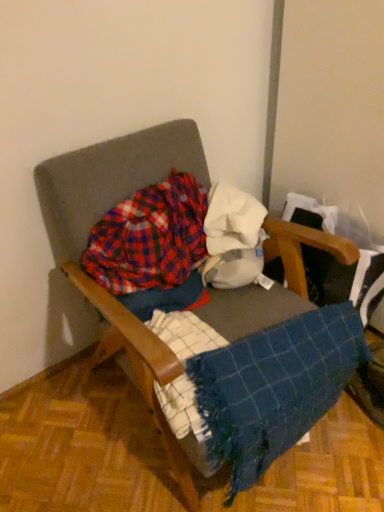
Question: From the image's perspective, relative to blue woven blanket at lower right, is wooden armchair at center above or below?

Choices:
 (A) below
 (B) above

Answer: (B)

Question: Does point (172, 375) appear closer or farther from the camera than point (253, 356)?

Choices:
 (A) farther
 (B) closer

Answer: (B)

Question: Which object is positioned closest to the plaid fabric at center?

Choices:
 (A) blue woven blanket at lower right
 (B) wooden armchair at center

Answer: (B)

Question: Estimate the real-world distances between objects in this image. Which object is closer to the wooden armchair at center?

Choices:
 (A) plaid fabric at center
 (B) blue woven blanket at lower right

Answer: (A)